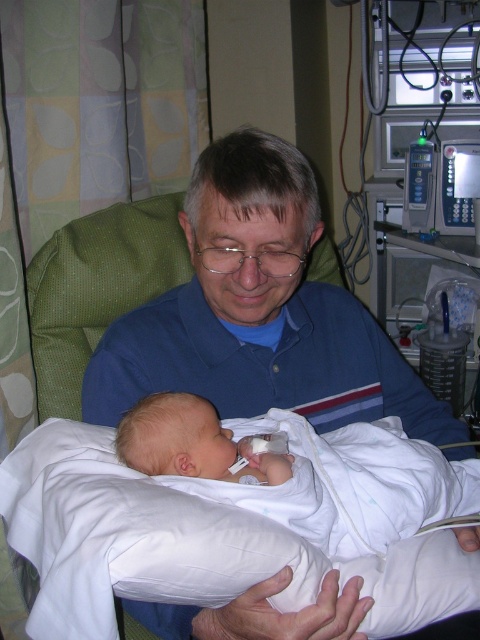
Is blue cotton shirt at center shorter than white soft swaddled newborn at center?

No.

Who is positioned more to the right, blue cotton shirt at center or white soft swaddled newborn at center?

white soft swaddled newborn at center is more to the right.

Which is in front, point (324, 339) or point (361, 480)?

Positioned in front is point (361, 480).

Locate an element on the screen. blue cotton shirt at center is located at coordinates (259, 312).